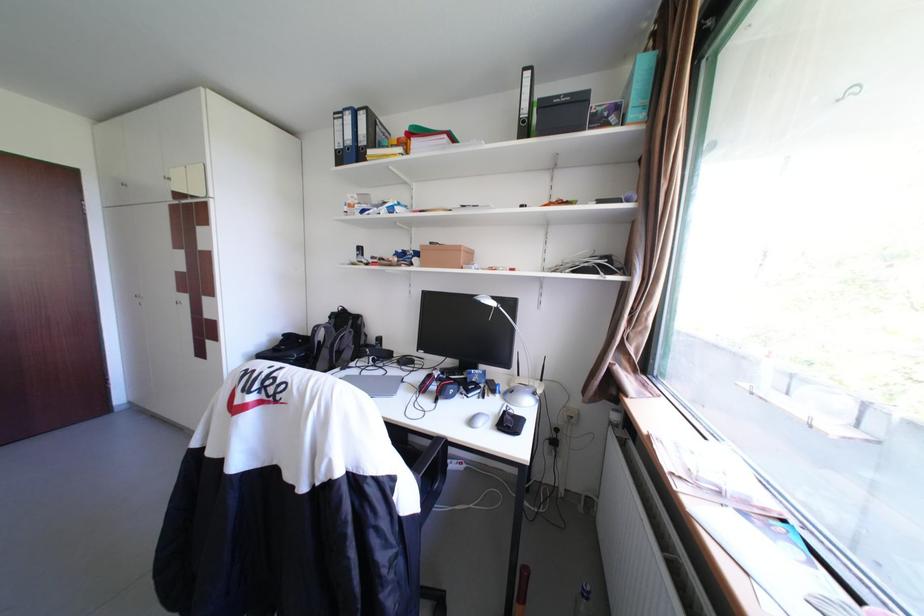
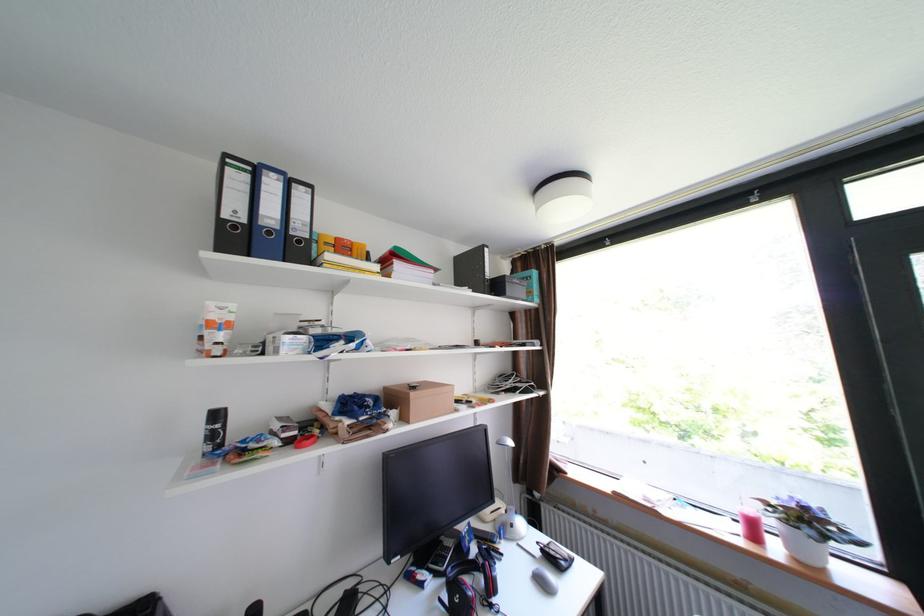
In the second image, find the point that corresponds to point (516, 411) in the first image.

(553, 551)